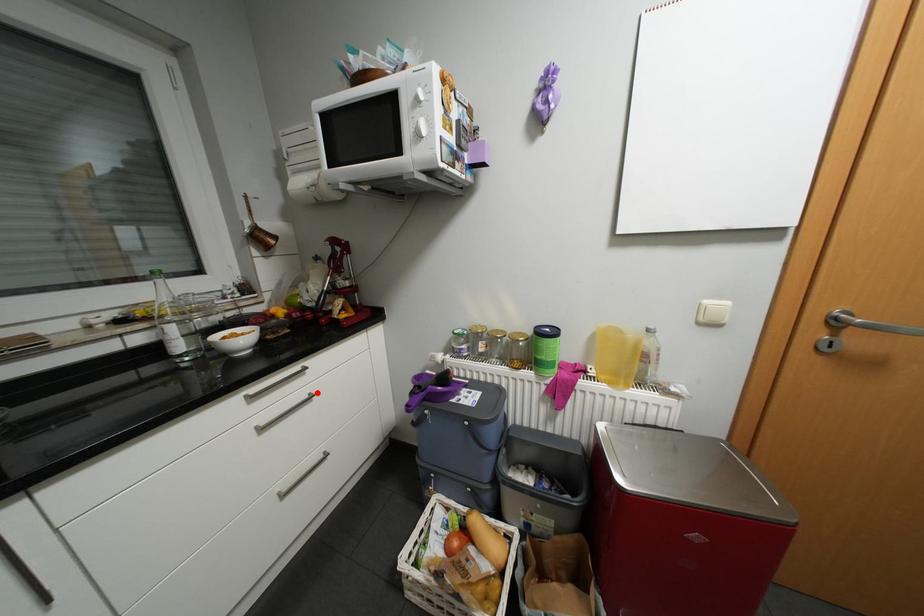
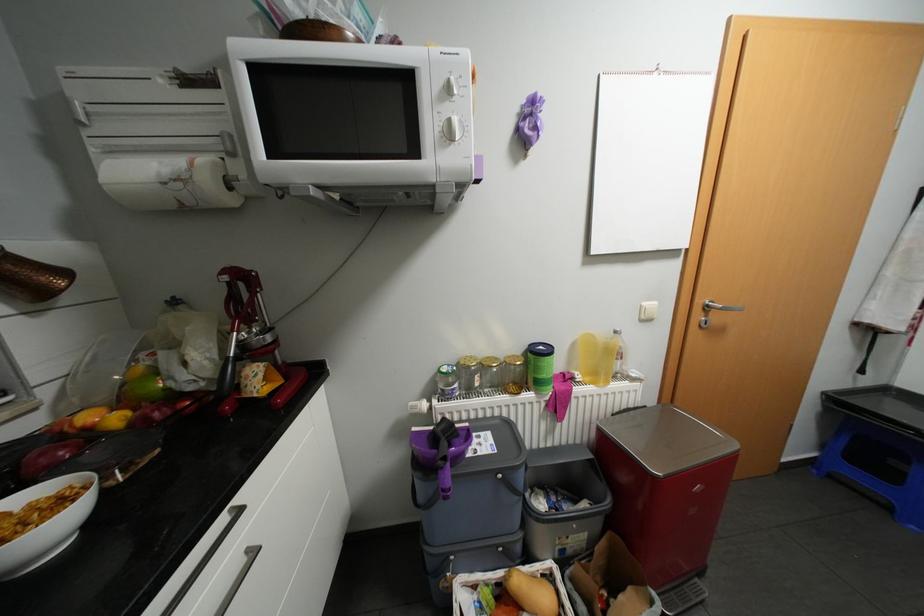
Find the pixel in the second image that matches the highlighted location in the first image.

(256, 549)